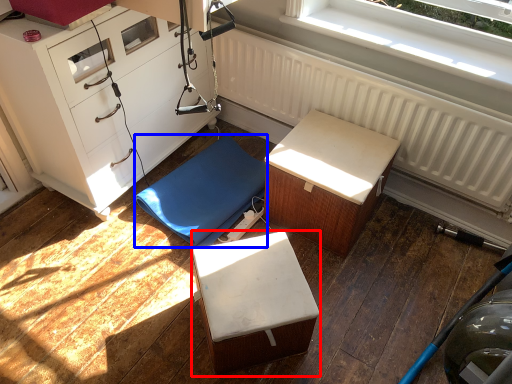
Question: Which point is further to the camera, furniture (highlighted by a red box) or furniture (highlighted by a blue box)?

Choices:
 (A) furniture
 (B) furniture

Answer: (B)